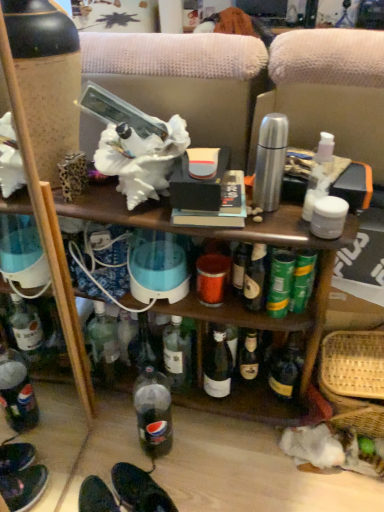
Question: From their relative heights in the image, would you say woven straw basket at lower right is taller or shorter than black leather shoes at lower center?

Choices:
 (A) tall
 (B) short

Answer: (A)

Question: Would you say woven straw basket at lower right is inside or outside black leather shoes at lower center?

Choices:
 (A) inside
 (B) outside

Answer: (B)

Question: From a real-world perspective, is woven straw basket at lower right positioned above or below black leather shoes at lower center?

Choices:
 (A) below
 (B) above

Answer: (B)

Question: Is black leather shoes at lower center bigger or smaller than woven straw basket at lower right?

Choices:
 (A) big
 (B) small

Answer: (B)

Question: Looking at their shapes, would you say black leather shoes at lower center is wider or thinner than woven straw basket at lower right?

Choices:
 (A) thin
 (B) wide

Answer: (A)

Question: From the image's perspective, is black leather shoes at lower center above or below woven straw basket at lower right?

Choices:
 (A) above
 (B) below

Answer: (B)

Question: Considering the relative positions of black leather shoes at lower center and woven straw basket at lower right in the image provided, is black leather shoes at lower center to the left or to the right of woven straw basket at lower right?

Choices:
 (A) left
 (B) right

Answer: (A)